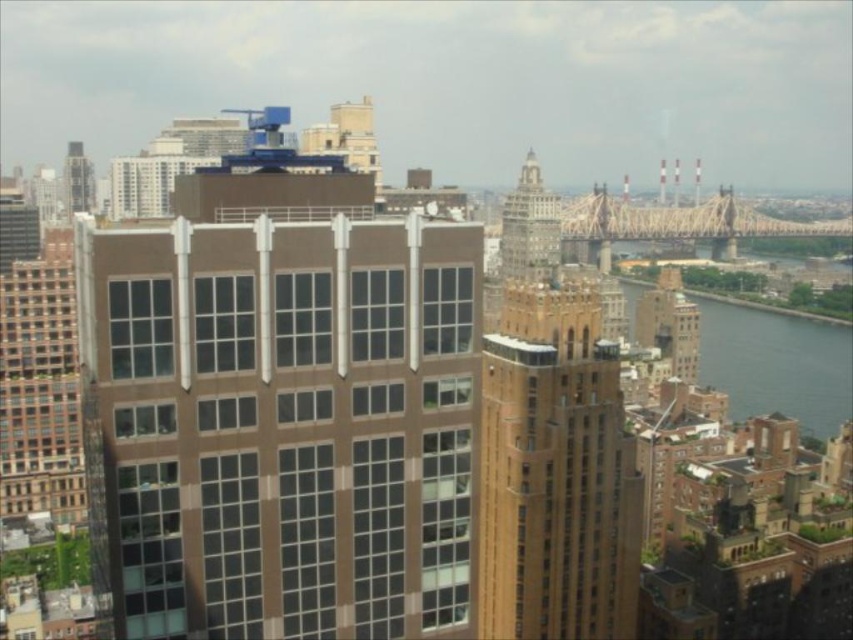
Between blue water at lower right and silver metallic tower at upper center, which one has more height?

Standing taller between the two is blue water at lower right.

Is point (724, 337) in front of point (534, 243)?

No, it is not.

Which is behind, point (764, 406) or point (521, 232)?

Positioned behind is point (764, 406).

This screenshot has width=853, height=640. Find the location of `blue water at lower right`. blue water at lower right is located at coordinates (776, 364).

Is point (599, 548) positioned before point (91, 198)?

Yes, point (599, 548) is closer to viewer.

Is brown brick building at center smaller than metallic silver tower at upper left?

No.

Does point (560, 486) come farther from viewer compared to point (68, 211)?

That is False.

At what (x,y) coordinates should I click in order to perform the action: click on brown brick building at center. Please return your answer as a coordinate pair (x, y). Looking at the image, I should click on (554, 472).

Who is higher up, silver metallic tower at upper center or metallic silver tower at upper left?

metallic silver tower at upper left is above.

The height and width of the screenshot is (640, 853). What do you see at coordinates (529, 227) in the screenshot? I see `silver metallic tower at upper center` at bounding box center [529, 227].

The width and height of the screenshot is (853, 640). What are the coordinates of `silver metallic tower at upper center` in the screenshot? It's located at (529, 227).